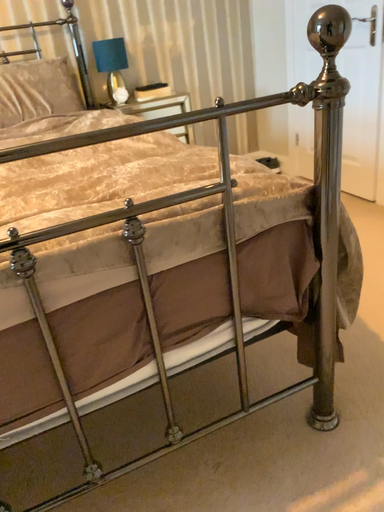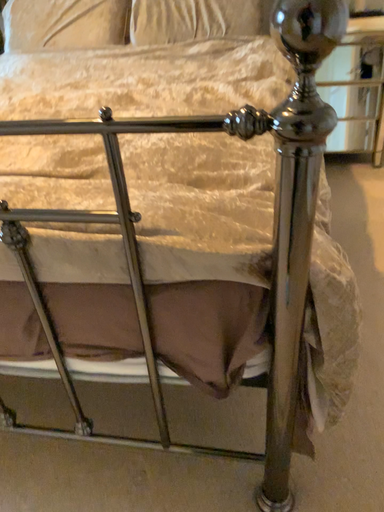
Question: Which way did the camera rotate in the video?

Choices:
 (A) rotated right
 (B) rotated left

Answer: (B)